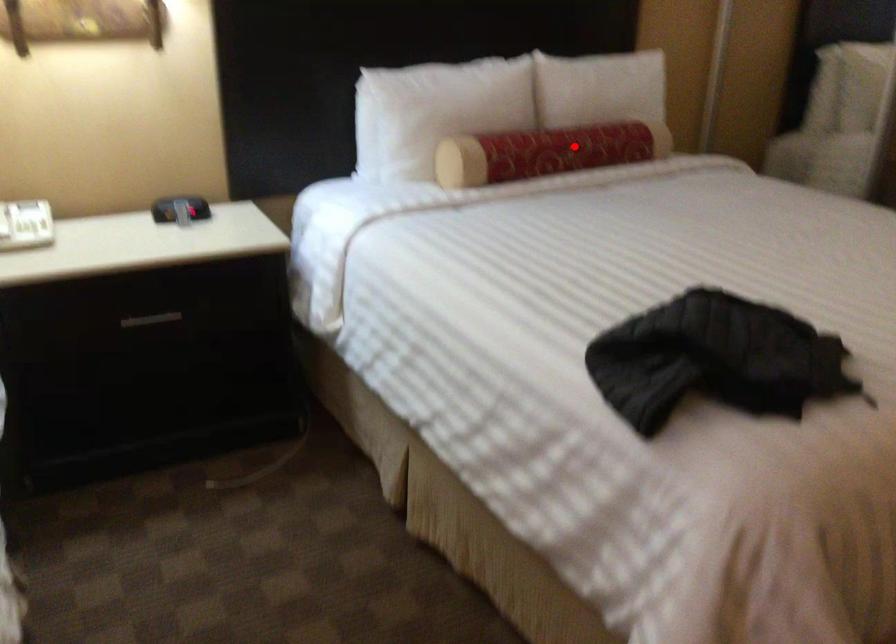
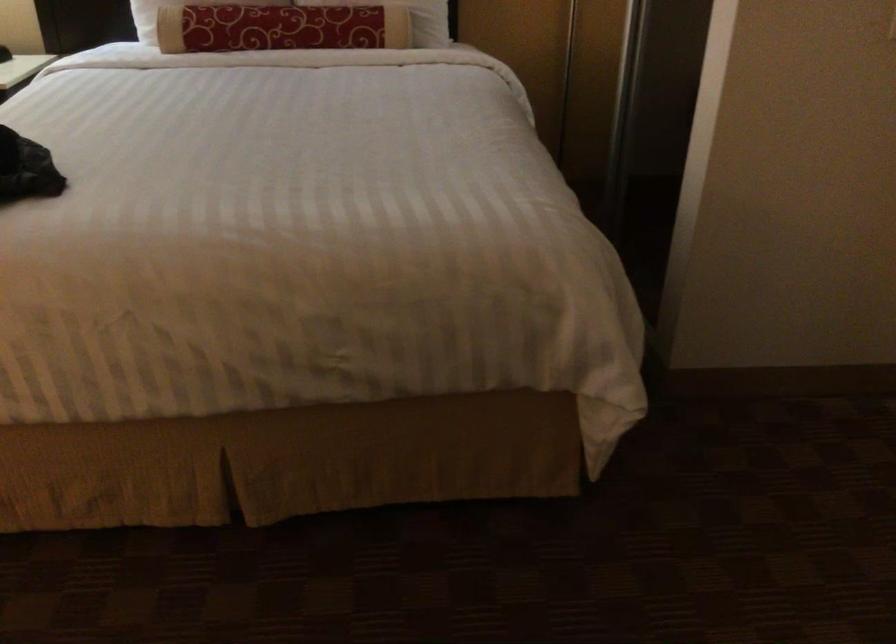
Find the pixel in the second image that matches the highlighted location in the first image.

(280, 28)